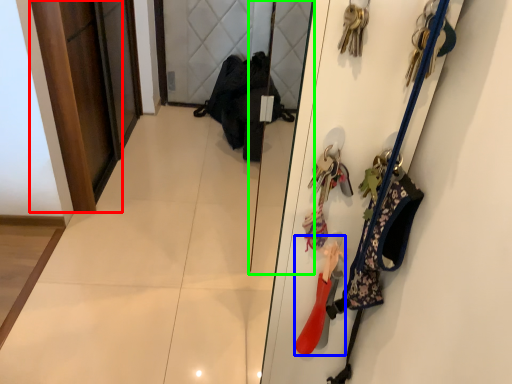
Question: Considering the real-world distances, which object is closest to door (highlighted by a red box)? accessory (highlighted by a blue box) or mirror (highlighted by a green box).

Choices:
 (A) accessory
 (B) mirror

Answer: (B)